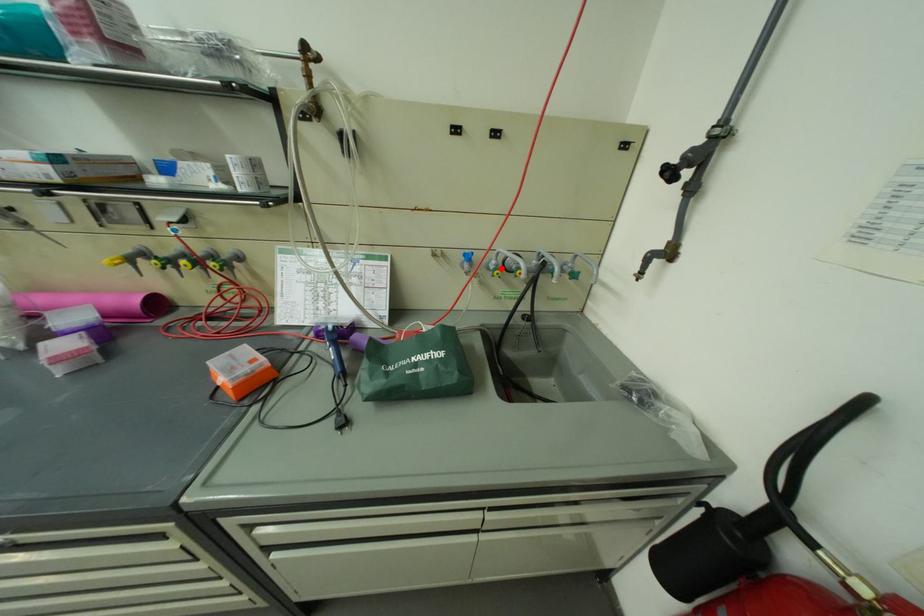
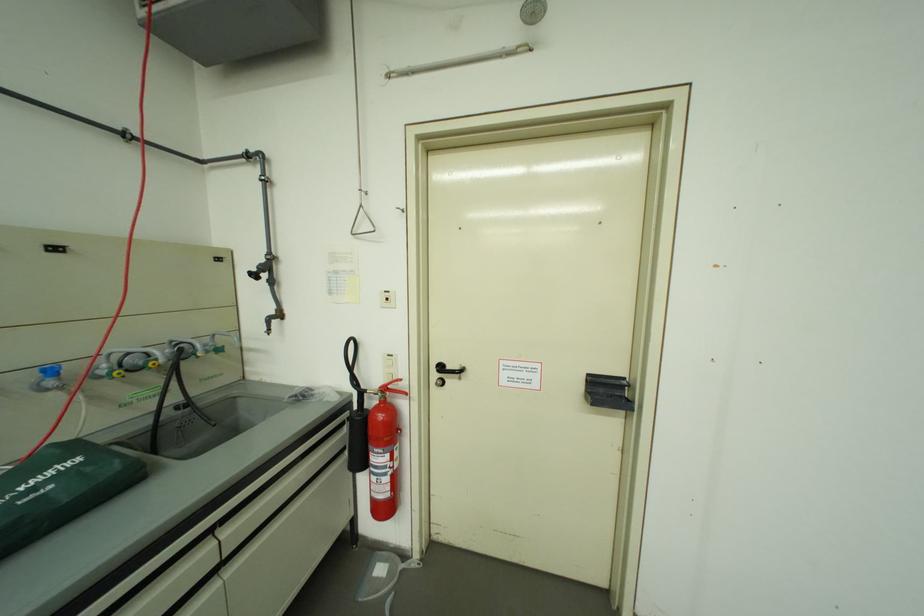
Question: I am providing you with two images of the same scene from different viewpoints. A red point is marked on the first image. Is the red point's position out of view in image 2?

Choices:
 (A) Yes
 (B) No

Answer: (B)